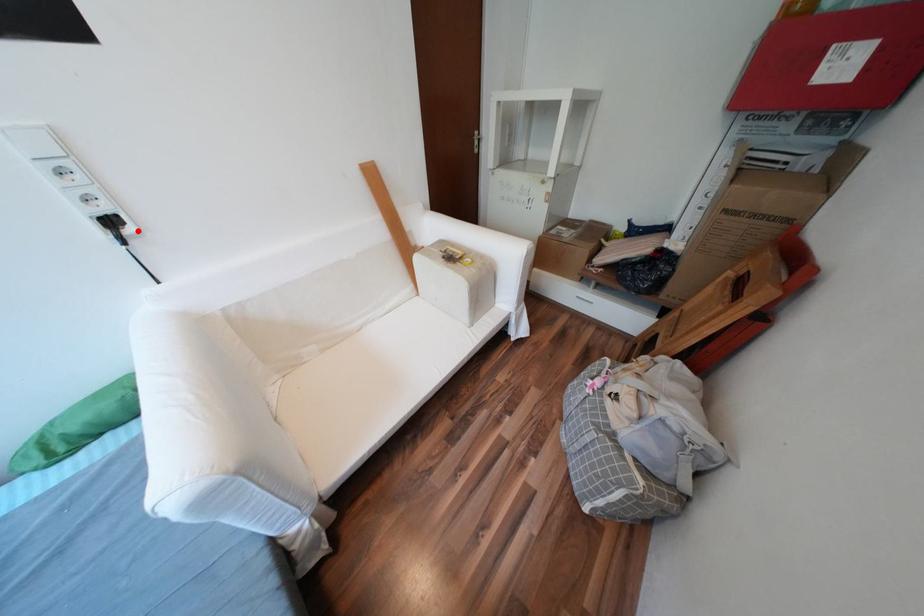
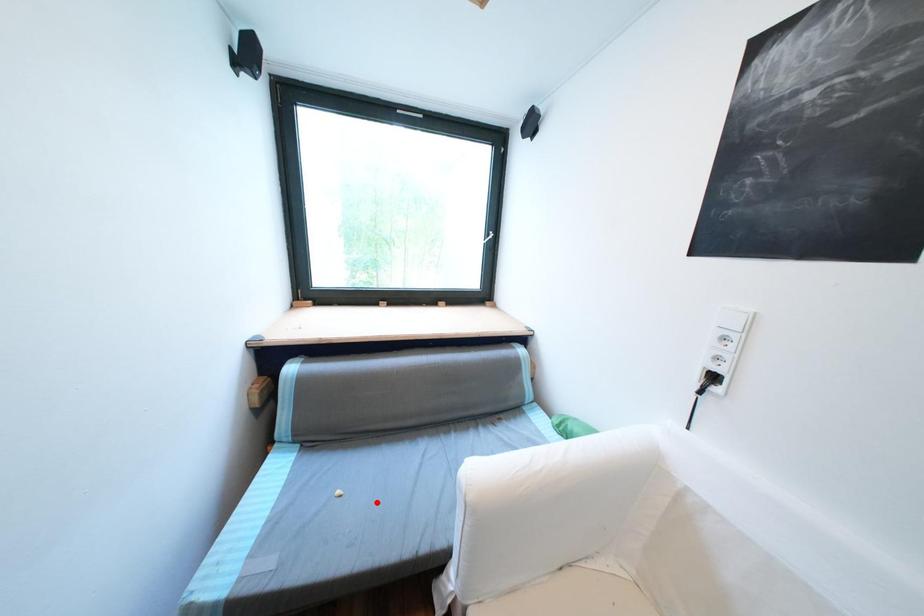
I am providing you with two images of the same scene from different viewpoints. A red point is marked on the first image and another point is marked on the second image. Does the point marked in image1 correspond to the same location as the one in image2?

No